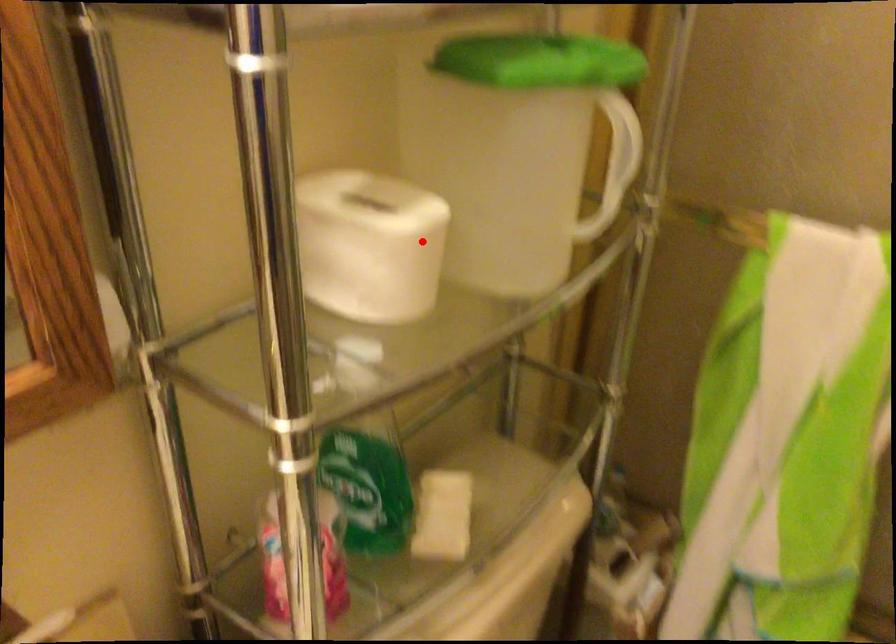
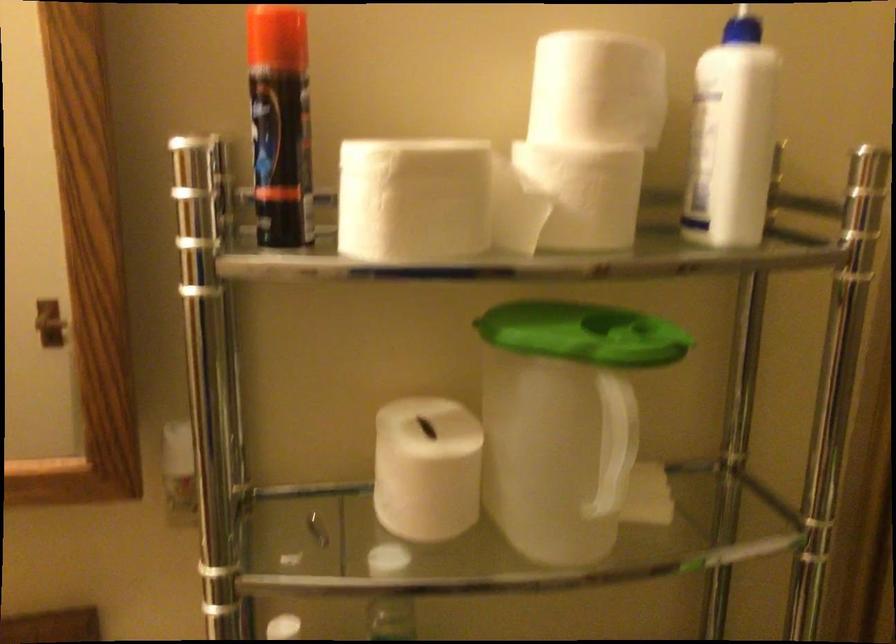
In the second image, find the point that corresponds to the highlighted location in the first image.

(426, 469)